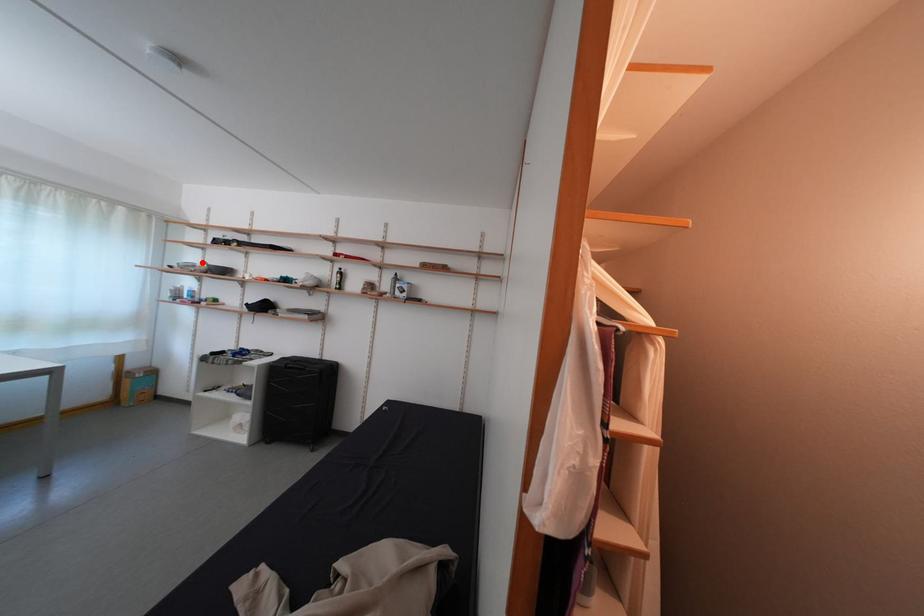
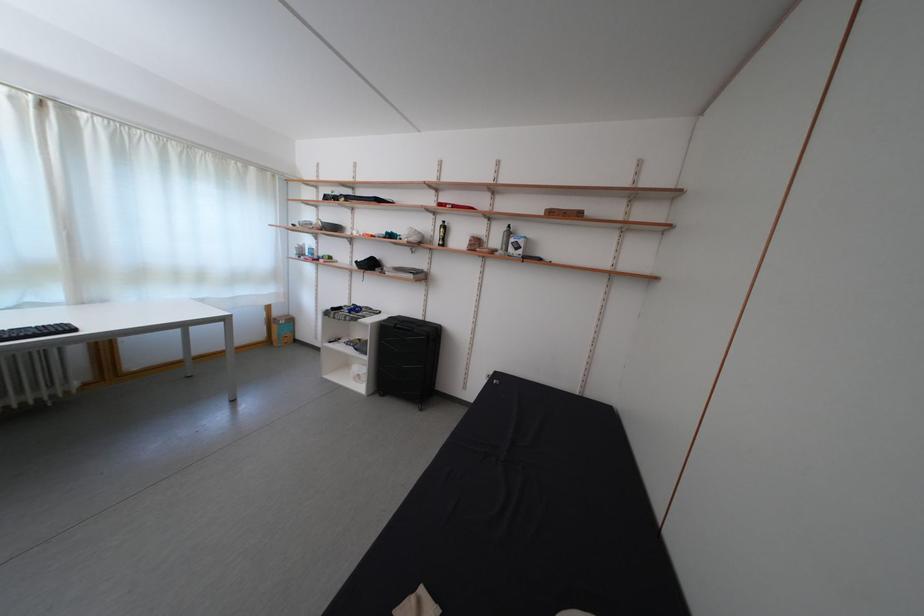
Where in the second image is the point corresponding to the highlighted location from the first image?

(319, 221)